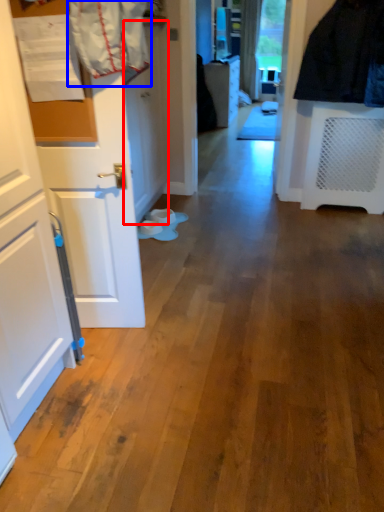
Question: Which of the following is the closest to the observer, door (highlighted by a red box) or laundry (highlighted by a blue box)?

Choices:
 (A) door
 (B) laundry

Answer: (B)